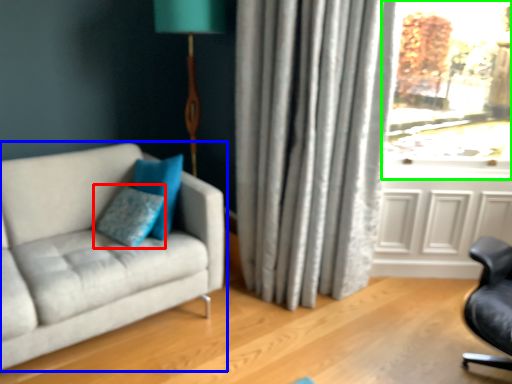
Question: Which object is positioned farthest from pillow (highlighted by a red box)? Select from studio couch (highlighted by a blue box) and window (highlighted by a green box).

Choices:
 (A) studio couch
 (B) window

Answer: (B)